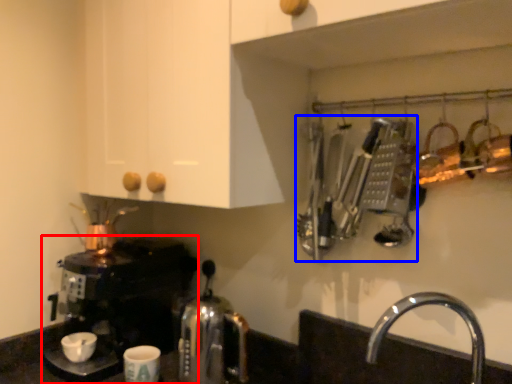
Question: Which object appears farthest to the camera in this image, coffee maker (highlighted by a red box) or cutlery (highlighted by a blue box)?

Choices:
 (A) coffee maker
 (B) cutlery

Answer: (A)